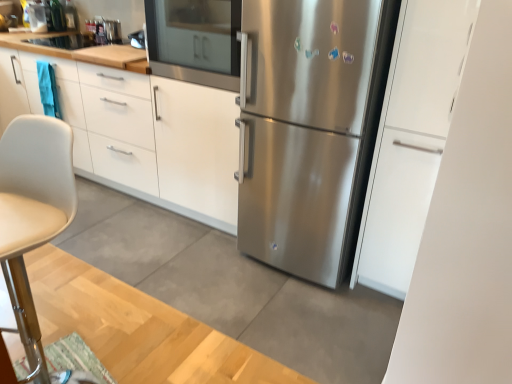
Question: Is beige leather chair at left not near stainless steel oven at center?

Choices:
 (A) no
 (B) yes

Answer: (B)

Question: Is the position of beige leather chair at left more distant than that of stainless steel oven at center?

Choices:
 (A) yes
 (B) no

Answer: (B)

Question: Does beige leather chair at left have a greater width compared to stainless steel oven at center?

Choices:
 (A) no
 (B) yes

Answer: (A)

Question: Would you say stainless steel oven at center is part of beige leather chair at left's contents?

Choices:
 (A) yes
 (B) no

Answer: (B)

Question: Is beige leather chair at left oriented away from stainless steel oven at center?

Choices:
 (A) no
 (B) yes

Answer: (B)

Question: Visually, is satin white cabinet at right, which is counted as the 1th cabinetry, starting from the right, positioned to the left or to the right of stainless steel refrigerator at center?

Choices:
 (A) right
 (B) left

Answer: (A)

Question: From the image's perspective, relative to stainless steel refrigerator at center, is satin white cabinet at right, marked as the second cabinetry in a back-to-front arrangement, above or below?

Choices:
 (A) below
 (B) above

Answer: (A)

Question: In terms of height, does satin white cabinet at right, which is counted as the 1th cabinetry, starting from the right, look taller or shorter compared to stainless steel refrigerator at center?

Choices:
 (A) short
 (B) tall

Answer: (B)

Question: From a real-world perspective, is satin white cabinet at right, marked as the second cabinetry in a back-to-front arrangement, physically located above or below stainless steel refrigerator at center?

Choices:
 (A) above
 (B) below

Answer: (A)

Question: From the image's perspective, relative to beige leather chair at left, is white matte cabinet at upper left, which ranks as the 1th cabinetry in left-to-right order, above or below?

Choices:
 (A) above
 (B) below

Answer: (A)

Question: Does point (182, 200) appear closer or farther from the camera than point (19, 264)?

Choices:
 (A) closer
 (B) farther

Answer: (B)

Question: Do you think white matte cabinet at upper left, marked as the 1th cabinetry in a back-to-front arrangement, is within beige leather chair at left, or outside of it?

Choices:
 (A) inside
 (B) outside

Answer: (B)

Question: From a real-world perspective, is white matte cabinet at upper left, marked as the 1th cabinetry in a back-to-front arrangement, above or below beige leather chair at left?

Choices:
 (A) above
 (B) below

Answer: (B)

Question: In the image, is beige leather chair at left positioned in front of or behind stainless steel refrigerator at center?

Choices:
 (A) behind
 (B) front

Answer: (B)

Question: From the image's perspective, relative to stainless steel refrigerator at center, is beige leather chair at left above or below?

Choices:
 (A) below
 (B) above

Answer: (A)